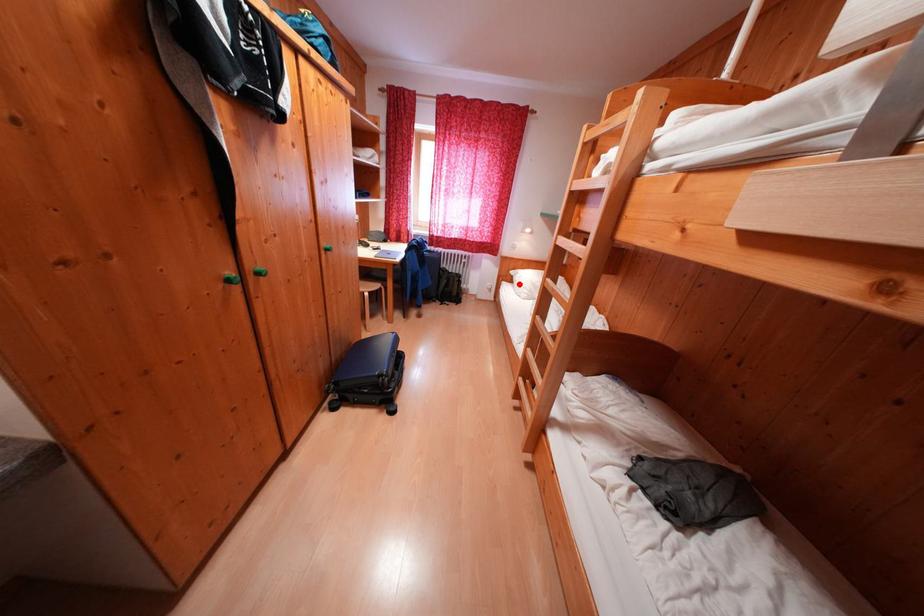
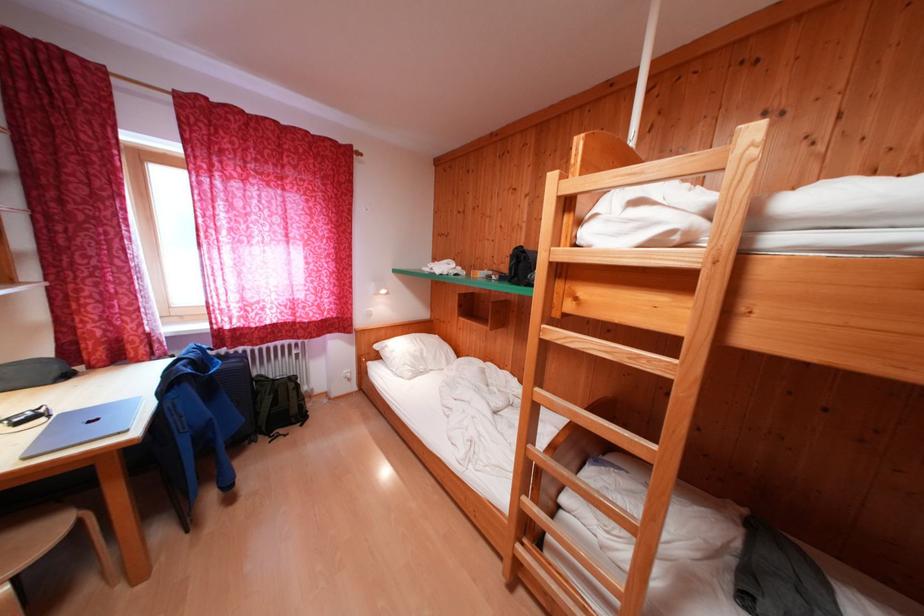
Question: I am providing you with two images of the same scene from different viewpoints. A red point is shown in image1. For the corresponding object point in image2, is it positioned nearer or farther from the camera?

Choices:
 (A) Nearer
 (B) Farther

Answer: (B)